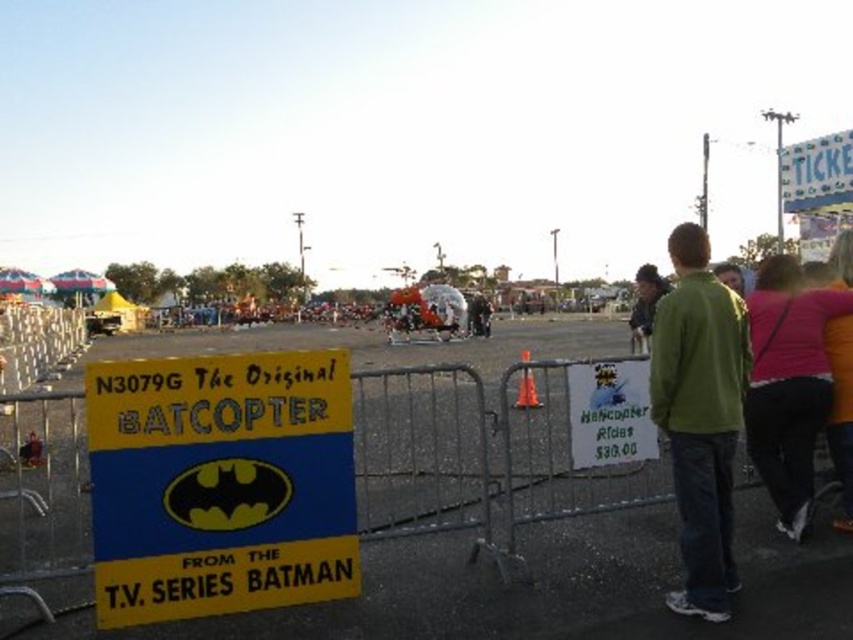
Question: Can you confirm if green fleece jacket at center is wider than green cotton hoodie at center?

Choices:
 (A) yes
 (B) no

Answer: (B)

Question: Is yellow paper sign at lower left below pink fabric shirt at right?

Choices:
 (A) no
 (B) yes

Answer: (B)

Question: Can you confirm if green fleece jacket at center is positioned below green cotton hoodie at center?

Choices:
 (A) yes
 (B) no

Answer: (A)

Question: Which point is closer to the camera taking this photo?

Choices:
 (A) coord(141,435)
 (B) coord(714,337)

Answer: (A)

Question: Based on their relative distances, which object is farther from the yellow paper sign at lower left?

Choices:
 (A) green fleece jacket at center
 (B) pink fabric shirt at right
 (C) green cotton hoodie at center

Answer: (C)

Question: Which point appears closest to the camera in this image?

Choices:
 (A) (706, 316)
 (B) (207, 369)

Answer: (A)